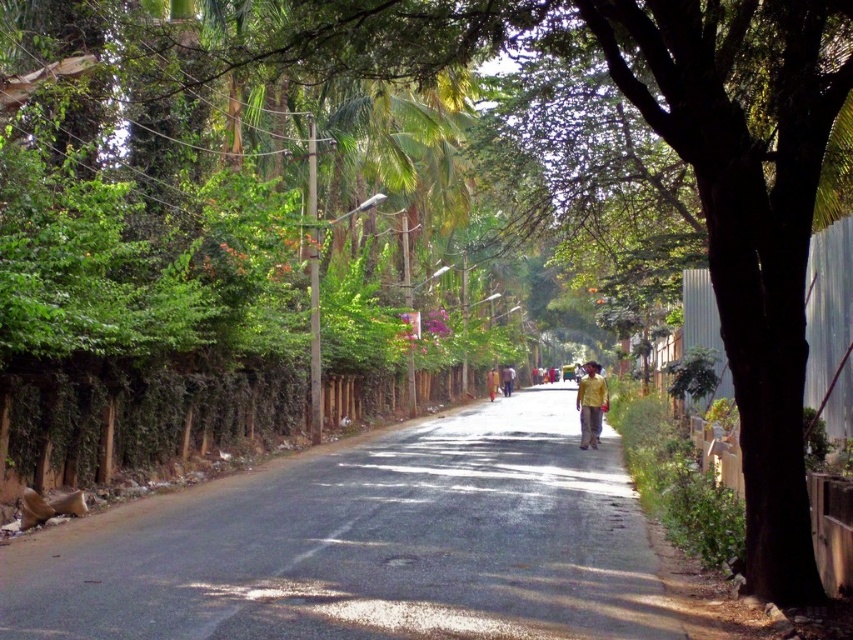
Which of these two, asphalt road at center or yellow fabric shirt at center, stands taller?

yellow fabric shirt at center

Can you confirm if asphalt road at center is bigger than yellow fabric shirt at center?

Yes, asphalt road at center is bigger than yellow fabric shirt at center.

I want to click on asphalt road at center, so click(x=370, y=545).

Where is `asphalt road at center`? This screenshot has height=640, width=853. asphalt road at center is located at coordinates (370, 545).

Is point (257, 547) positioned behind point (512, 385)?

No, it is not.

Where is `asphalt road at center`? The width and height of the screenshot is (853, 640). asphalt road at center is located at coordinates (370, 545).

This screenshot has height=640, width=853. Find the location of `asphalt road at center`. asphalt road at center is located at coordinates (370, 545).

Is yellow fabric shirt at center positioned before yellow fabric person at center?

Yes, it is in front of yellow fabric person at center.

Which is in front, point (579, 397) or point (509, 392)?

Point (579, 397) is in front.

The image size is (853, 640). I want to click on yellow fabric shirt at center, so click(x=590, y=404).